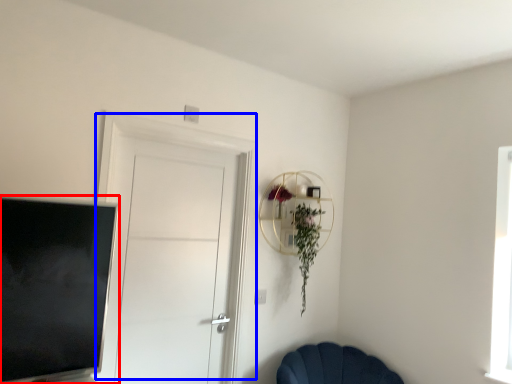
Question: Which point is closer to the camera, television (highlighted by a red box) or door (highlighted by a blue box)?

Choices:
 (A) television
 (B) door

Answer: (A)